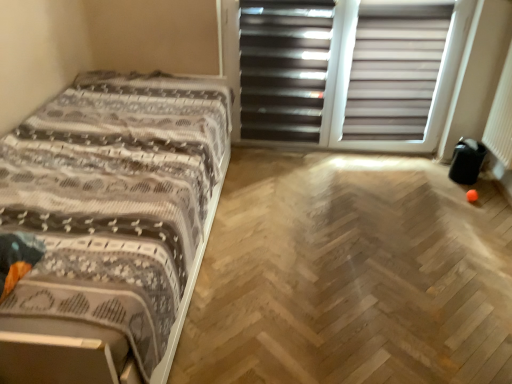
Question: Considering their positions, is matte white blinds at upper right located in front of or behind black matte screen door at upper center, the 1th screen door positioned from the left?

Choices:
 (A) behind
 (B) front

Answer: (B)

Question: From their relative heights in the image, would you say matte white blinds at upper right is taller or shorter than black matte screen door at upper center, the 1th screen door positioned from the left?

Choices:
 (A) short
 (B) tall

Answer: (A)

Question: Which object is positioned closest to the black matte screen door at upper center, which ranks as the 2th screen door in right-to-left order?

Choices:
 (A) white plastic blinds at upper center, the 2th screen door when ordered from left to right
 (B) patterned fabric bed at left
 (C) matte white blinds at upper right

Answer: (A)

Question: Based on their relative distances, which object is nearer to the black matte screen door at upper center, the 1th screen door positioned from the left?

Choices:
 (A) matte white blinds at upper right
 (B) patterned fabric bed at left
 (C) white plastic blinds at upper center, arranged as the first screen door when viewed from the right

Answer: (C)